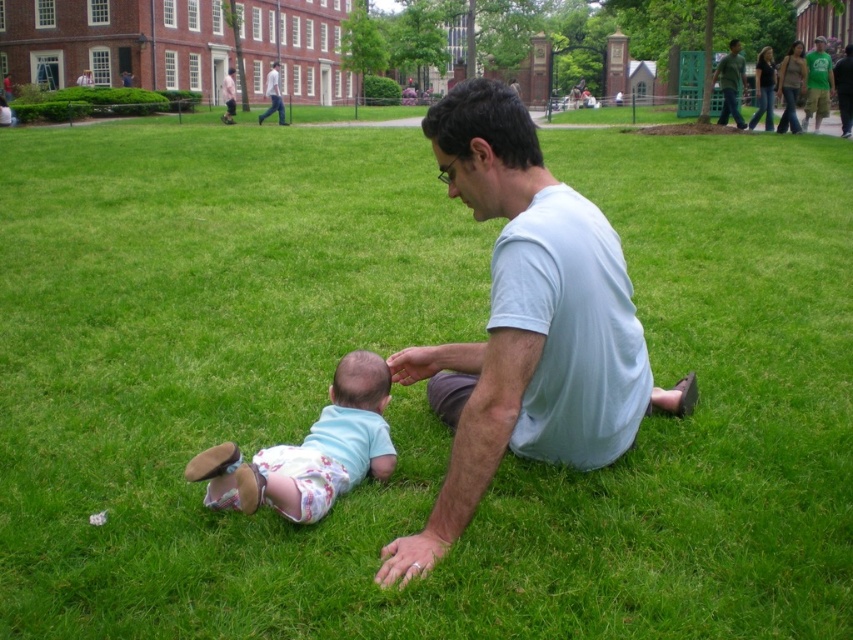
The image size is (853, 640). What do you see at coordinates (817, 84) in the screenshot? I see `green t-shirt at upper right` at bounding box center [817, 84].

Can you confirm if green t-shirt at upper right is shorter than light blue shirt at center?

Yes, green t-shirt at upper right is shorter than light blue shirt at center.

The image size is (853, 640). What are the coordinates of `green t-shirt at upper right` in the screenshot? It's located at (817, 84).

Describe the element at coordinates (273, 93) in the screenshot. This screenshot has width=853, height=640. I see `light blue shirt at center` at that location.

Between light blue shirt at center and pink fabric shirt at upper center, which one has more height?

Standing taller between the two is light blue shirt at center.

You are a GUI agent. You are given a task and a screenshot of the screen. Output one action in this format:
    pyautogui.click(x=<x>, y=<y>)
    Task: Click on the light blue shirt at center
    The height and width of the screenshot is (640, 853).
    Given the screenshot: What is the action you would take?
    pyautogui.click(x=273, y=93)

Is the position of light blue cotton shirt at center less distant than that of pink fabric shirt at upper center?

That is True.

Which is behind, point (466, 342) or point (222, 86)?

Positioned behind is point (222, 86).

At what (x,y) coordinates should I click in order to perform the action: click on light blue cotton shirt at center. Please return your answer as a coordinate pair (x, y). This screenshot has height=640, width=853. Looking at the image, I should click on (526, 323).